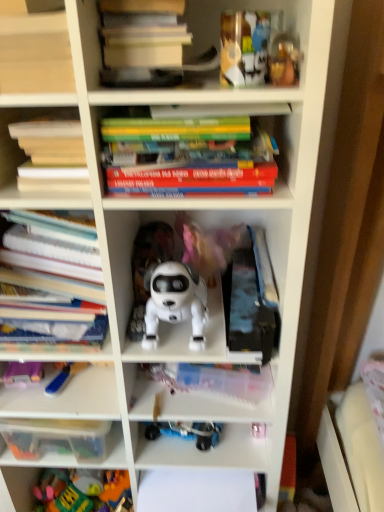
Question: Does hardcover books at upper center, the first book from the top, turn towards matte plastic books at upper left?

Choices:
 (A) yes
 (B) no

Answer: (B)

Question: Is hardcover books at upper center, the fourth book from the bottom, far from matte plastic books at upper left?

Choices:
 (A) no
 (B) yes

Answer: (A)

Question: Considering the relative sizes of hardcover books at upper center, the fourth book from the bottom, and matte plastic books at upper left in the image provided, is hardcover books at upper center, the fourth book from the bottom, wider than matte plastic books at upper left?

Choices:
 (A) no
 (B) yes

Answer: (B)

Question: Is hardcover books at upper center, the fourth book from the bottom, turned away from matte plastic books at upper left?

Choices:
 (A) yes
 (B) no

Answer: (B)

Question: Is hardcover books at upper center, the first book from the top, located outside matte plastic books at upper left?

Choices:
 (A) yes
 (B) no

Answer: (A)

Question: From the image's perspective, does hardcover books at upper center, the fourth book from the bottom, appear higher than matte plastic books at upper left?

Choices:
 (A) yes
 (B) no

Answer: (A)

Question: Is hardcover books at upper center, the fourth book from the bottom, facing away from hardcover books at center, marked as the third book in a bottom-to-top arrangement?

Choices:
 (A) yes
 (B) no

Answer: (B)

Question: Can you confirm if hardcover books at upper center, the fourth book from the bottom, is positioned to the left of hardcover books at center, marked as the third book in a bottom-to-top arrangement?

Choices:
 (A) yes
 (B) no

Answer: (A)

Question: Is hardcover books at upper center, the first book from the top, closer to the viewer compared to hardcover books at center, the 2th book viewed from the top?

Choices:
 (A) yes
 (B) no

Answer: (A)

Question: Is hardcover books at upper center, the first book from the top, outside of hardcover books at center, the 2th book viewed from the top?

Choices:
 (A) no
 (B) yes

Answer: (B)

Question: Is hardcover books at upper center, the fourth book from the bottom, wider than hardcover books at center, the 2th book viewed from the top?

Choices:
 (A) yes
 (B) no

Answer: (A)

Question: Can you confirm if hardcover books at upper center, the first book from the top, is bigger than hardcover books at center, the 2th book viewed from the top?

Choices:
 (A) no
 (B) yes

Answer: (A)

Question: From the image's perspective, is metallic gold toy at upper right, which ranks as the 4th toy in bottom-to-top order, under blue plastic toy at lower left, the third toy positioned from the front?

Choices:
 (A) yes
 (B) no

Answer: (B)